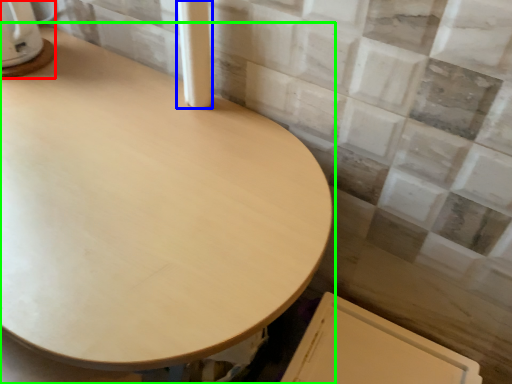
Question: Which object is the closest to the appliance (highlighted by a red box)? Choose among these: pillar (highlighted by a blue box) or table (highlighted by a green box).

Choices:
 (A) pillar
 (B) table

Answer: (A)